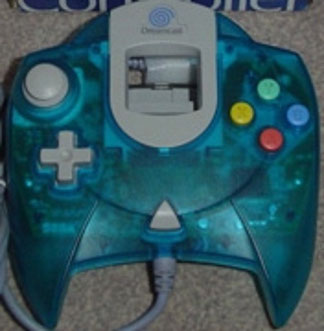
Locate an element on the screen. This screenshot has width=324, height=331. knob is located at coordinates (49, 89).